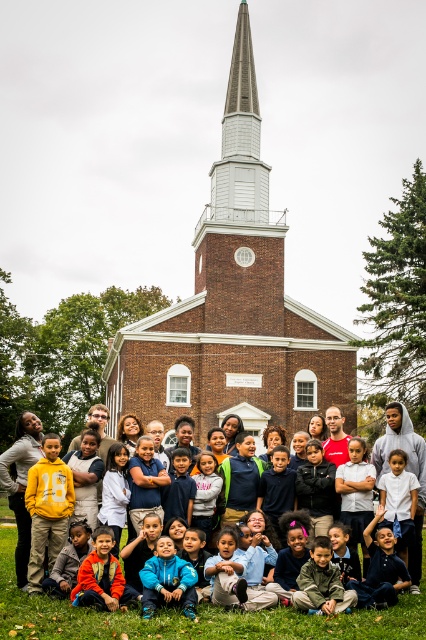
Who is positioned more to the left, brown brick chapel at center or matte yellow hoodie at center?

matte yellow hoodie at center is more to the left.

Locate an element on the screen. The height and width of the screenshot is (640, 426). brown brick chapel at center is located at coordinates (233, 305).